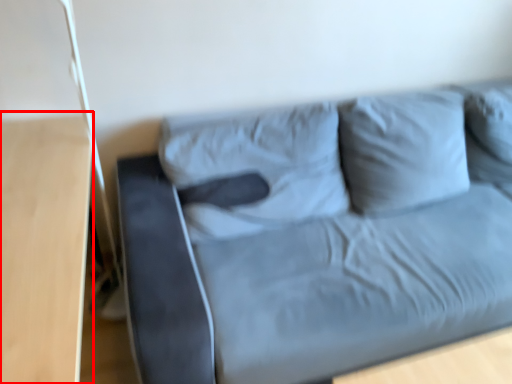
Question: In this image, where is table (annotated by the red box) located relative to studio couch?

Choices:
 (A) right
 (B) left

Answer: (B)